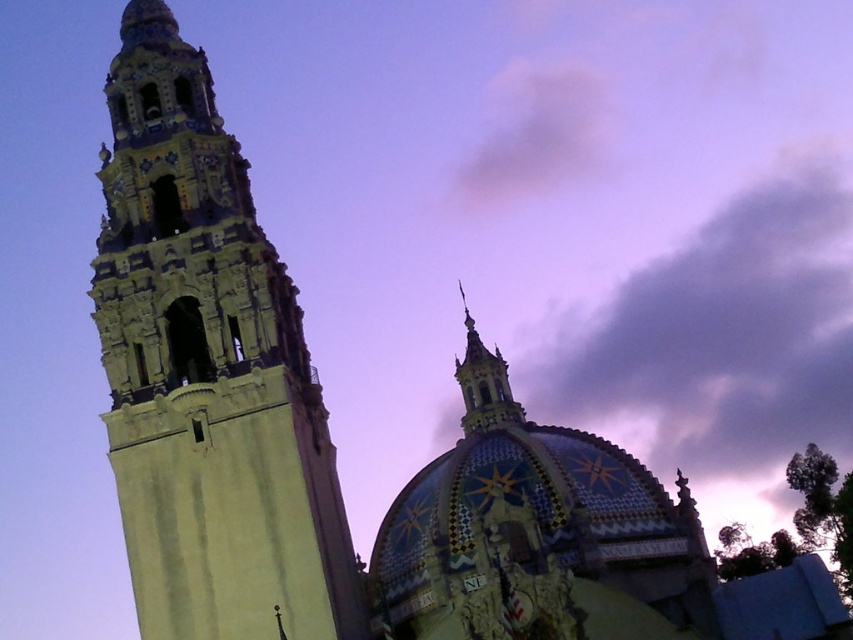
Question: Is light beige stone tower at left positioned before gray fluffy cloud at upper center?

Choices:
 (A) yes
 (B) no

Answer: (A)

Question: Which point is closer to the camera taking this photo?

Choices:
 (A) (202, 406)
 (B) (512, 83)

Answer: (A)

Question: Does light beige stone tower at left have a greater width compared to gray fluffy cloud at upper center?

Choices:
 (A) no
 (B) yes

Answer: (B)

Question: Which of the following is the farthest from the observer?

Choices:
 (A) (276, 317)
 (B) (473, 195)

Answer: (B)

Question: Is light beige stone tower at left closer to camera compared to gray fluffy cloud at upper center?

Choices:
 (A) no
 (B) yes

Answer: (B)